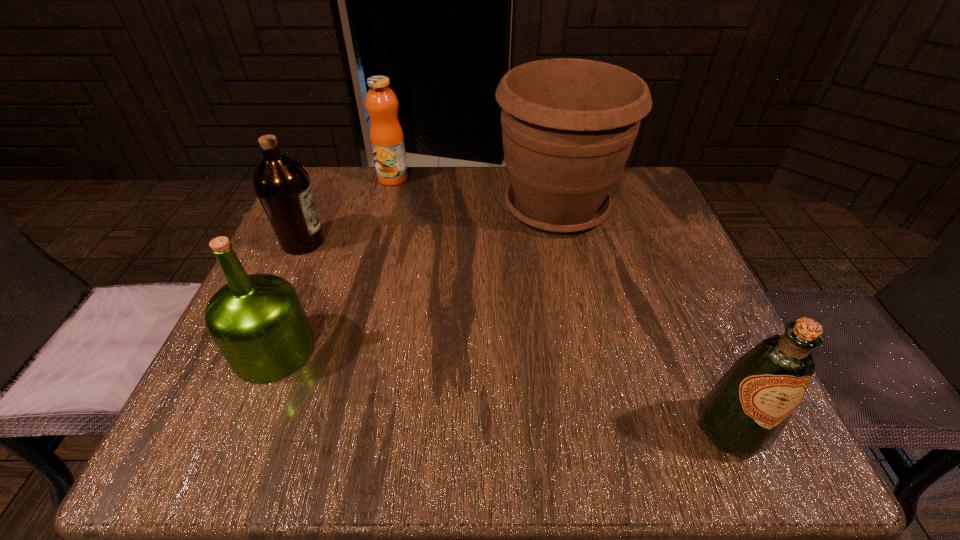
This screenshot has width=960, height=540. Find the location of `vacant space that satisfies the following two spatial constraints: 1. on the back side of the flowerpot; 2. on the right side of the second nearest olive oil`. vacant space that satisfies the following two spatial constraints: 1. on the back side of the flowerpot; 2. on the right side of the second nearest olive oil is located at coordinates (333, 208).